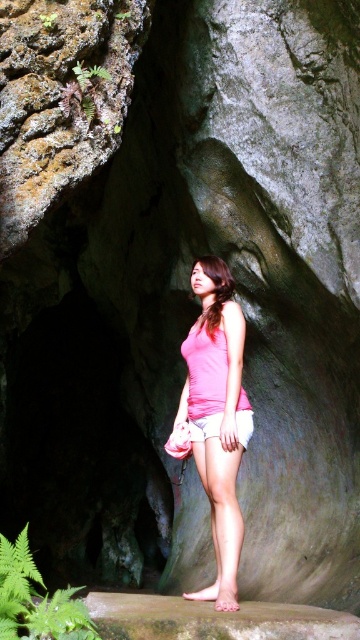
Question: Among these objects, which one is nearest to the camera?

Choices:
 (A) pink fabric shorts at center
 (B) white cotton shorts at center

Answer: (A)

Question: Is pink fabric shorts at center below white cotton shorts at center?

Choices:
 (A) yes
 (B) no

Answer: (B)

Question: Among these points, which one is farthest from the camera?

Choices:
 (A) (206, 417)
 (B) (231, 486)

Answer: (A)

Question: Is pink fabric shorts at center above white cotton shorts at center?

Choices:
 (A) no
 (B) yes

Answer: (B)

Question: Which point appears closest to the camera in this image?

Choices:
 (A) (236, 568)
 (B) (217, 413)

Answer: (A)

Question: Does pink fabric shorts at center appear under white cotton shorts at center?

Choices:
 (A) yes
 (B) no

Answer: (B)